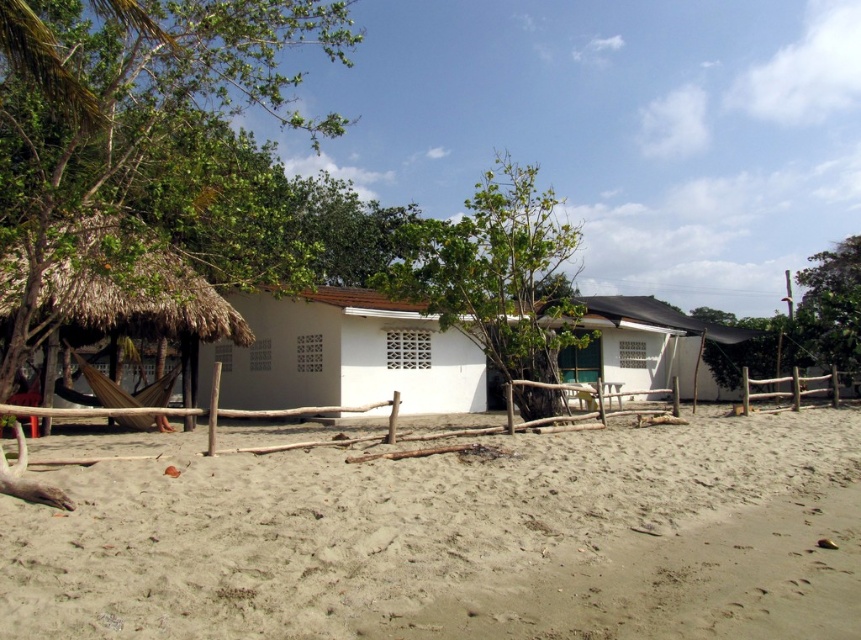
Between green leafy tree at left and green leafy tree at upper right, which one appears on the right side from the viewer's perspective?

Positioned to the right is green leafy tree at upper right.

Where is `green leafy tree at left`? green leafy tree at left is located at coordinates (141, 140).

The width and height of the screenshot is (861, 640). I want to click on green leafy tree at left, so click(x=141, y=140).

Is light beige sand at lower center smaller than green leafy tree at center?

Correct, light beige sand at lower center occupies less space than green leafy tree at center.

From the picture: Who is more forward, [240,572] or [469,240]?

Point [240,572]

Is point (249, 628) in front of point (556, 244)?

Yes, it is in front of point (556, 244).

At what (x,y) coordinates should I click in order to perform the action: click on light beige sand at lower center. Please return your answer as a coordinate pair (x, y). Looking at the image, I should click on (372, 524).

Can you confirm if light beige sand at lower center is positioned below green leafy tree at upper right?

Yes.

Can you confirm if light beige sand at lower center is thinner than green leafy tree at upper right?

Yes, light beige sand at lower center is thinner than green leafy tree at upper right.

Is point (183, 624) more distant than point (717, 376)?

No.

The image size is (861, 640). Identify the location of light beige sand at lower center. (372, 524).